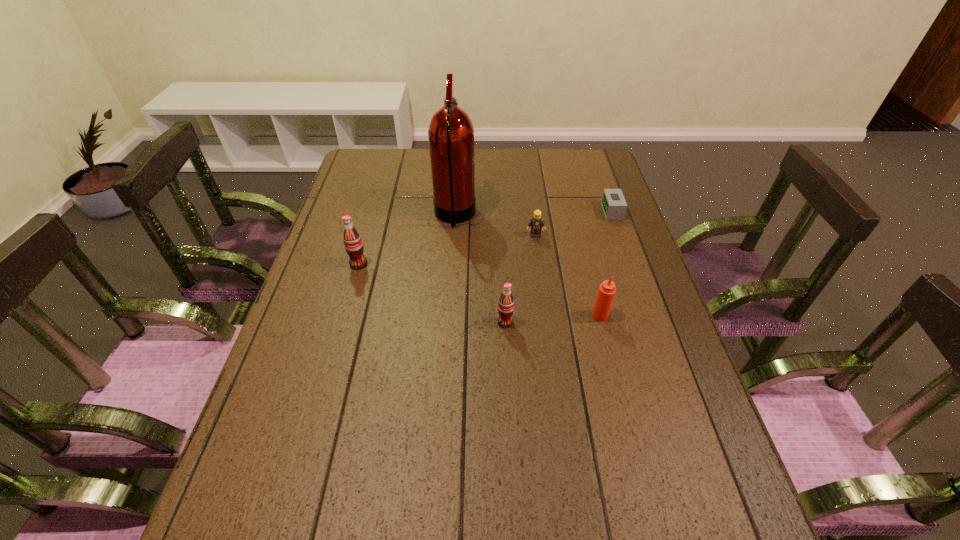
Image resolution: width=960 pixels, height=540 pixels. I want to click on vacant region that satisfies the following two spatial constraints: 1. on the front side of the Tabasco sauce; 2. on the left side of the leftmost object, so click(x=344, y=315).

Image resolution: width=960 pixels, height=540 pixels. I want to click on free region that satisfies the following two spatial constraints: 1. on the front-facing side of the fire extinguisher; 2. on the front side of the second tallest object, so click(x=451, y=264).

Locate an element on the screen. Image resolution: width=960 pixels, height=540 pixels. vacant space that satisfies the following two spatial constraints: 1. on the back side of the Tabasco sauce; 2. on the right side of the shorter soda is located at coordinates (505, 315).

Where is `free space that satisfies the following two spatial constraints: 1. in front of the fifth tallest object; 2. on the right side of the Tabasco sauce`? The image size is (960, 540). free space that satisfies the following two spatial constraints: 1. in front of the fifth tallest object; 2. on the right side of the Tabasco sauce is located at coordinates (546, 315).

Identify the location of vacant space that satisfies the following two spatial constraints: 1. on the front side of the second tallest object; 2. on the left side of the fourth object from right to left. (343, 322).

This screenshot has height=540, width=960. I want to click on vacant position in the image that satisfies the following two spatial constraints: 1. on the front-facing side of the nearer soda; 2. on the right side of the fire extinguisher, so click(x=447, y=322).

Identify the location of free space that satisfies the following two spatial constraints: 1. on the front-facing side of the third object from left to right; 2. on the right side of the fire extinguisher. (447, 322).